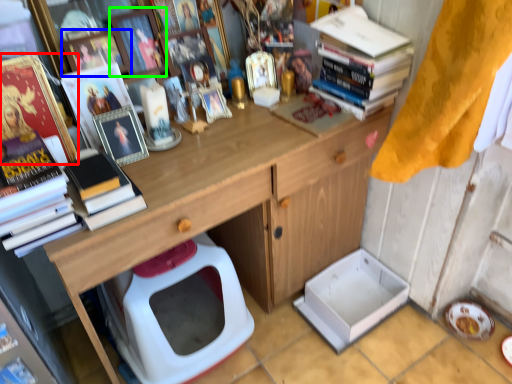
Question: Estimate the real-world distances between objects in this image. Which object is farther from book (highlighted by a red box), picture frame (highlighted by a blue box) or picture frame (highlighted by a green box)?

Choices:
 (A) picture frame
 (B) picture frame

Answer: (B)